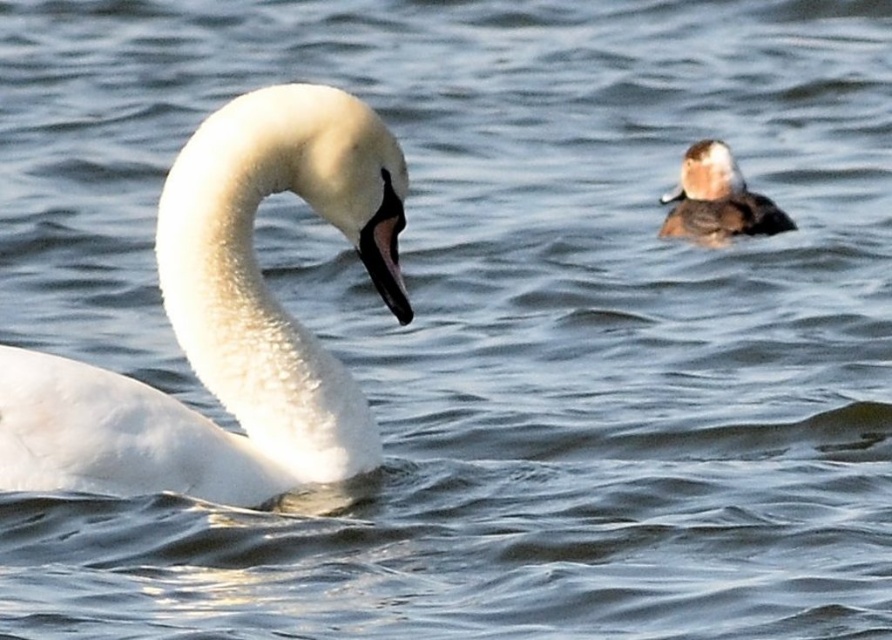
Question: Which point is farther to the camera?

Choices:
 (A) brown speckled duck at upper right
 (B) black glossy beak at center

Answer: (A)

Question: Is white matte swan at left smaller than brown speckled duck at upper right?

Choices:
 (A) no
 (B) yes

Answer: (A)

Question: Does brown speckled duck at upper right appear on the right side of black glossy beak at center?

Choices:
 (A) yes
 (B) no

Answer: (A)

Question: Which object is positioned closest to the black glossy beak at center?

Choices:
 (A) white matte swan at left
 (B) brown speckled duck at upper right

Answer: (A)

Question: Which object is closer to the camera taking this photo?

Choices:
 (A) black glossy beak at center
 (B) white matte swan at left

Answer: (B)

Question: Does white matte swan at left appear on the left side of black glossy beak at center?

Choices:
 (A) no
 (B) yes

Answer: (B)